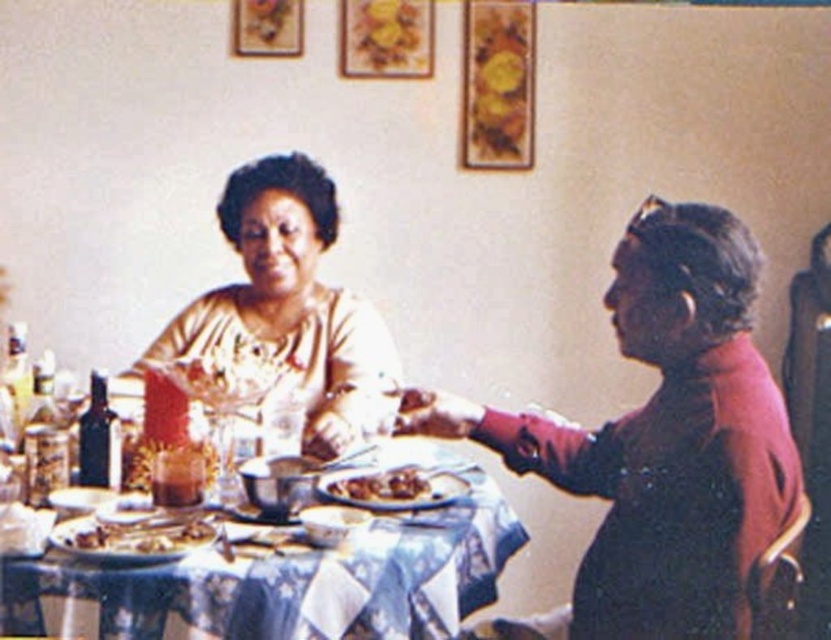
Question: Is matte gold dress at center smaller than shiny brown meat at center?

Choices:
 (A) no
 (B) yes

Answer: (A)

Question: Which of these objects is positioned closest to the blue printed fabric tablecloth at center?

Choices:
 (A) matte gold dress at center
 (B) shiny brown meat at center
 (C) gold textured blouse at upper left

Answer: (A)

Question: Does matte gold dress at center have a smaller size compared to blue printed fabric tablecloth at center?

Choices:
 (A) yes
 (B) no

Answer: (B)

Question: Does matte gold dress at center have a lesser width compared to gold textured blouse at upper left?

Choices:
 (A) yes
 (B) no

Answer: (B)

Question: Which point appears farthest from the camera in this image?

Choices:
 (A) pyautogui.click(x=348, y=376)
 (B) pyautogui.click(x=407, y=467)

Answer: (A)

Question: Estimate the real-world distances between objects in this image. Which object is farther from the blue printed fabric tablecloth at center?

Choices:
 (A) gold textured blouse at upper left
 (B) matte gold dress at center

Answer: (A)